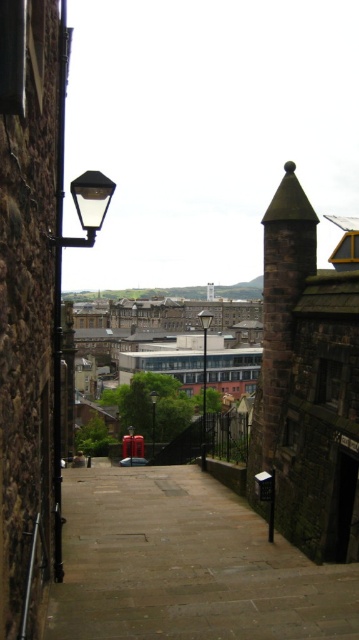
Question: Does brown stone pavement at center appear over matte black streetlamp at upper left?

Choices:
 (A) yes
 (B) no

Answer: (B)

Question: Does brown stone pavement at center appear over matte black streetlamp at upper left?

Choices:
 (A) yes
 (B) no

Answer: (B)

Question: Which of the following is the farthest from the observer?

Choices:
 (A) brown stone pavement at center
 (B) matte black streetlamp at upper left

Answer: (B)

Question: From the image, what is the correct spatial relationship of brown stone pavement at center in relation to matte black streetlamp at upper left?

Choices:
 (A) right
 (B) left

Answer: (A)

Question: Among these objects, which one is farthest from the camera?

Choices:
 (A) brown stone pavement at center
 (B) matte black streetlamp at upper left

Answer: (B)